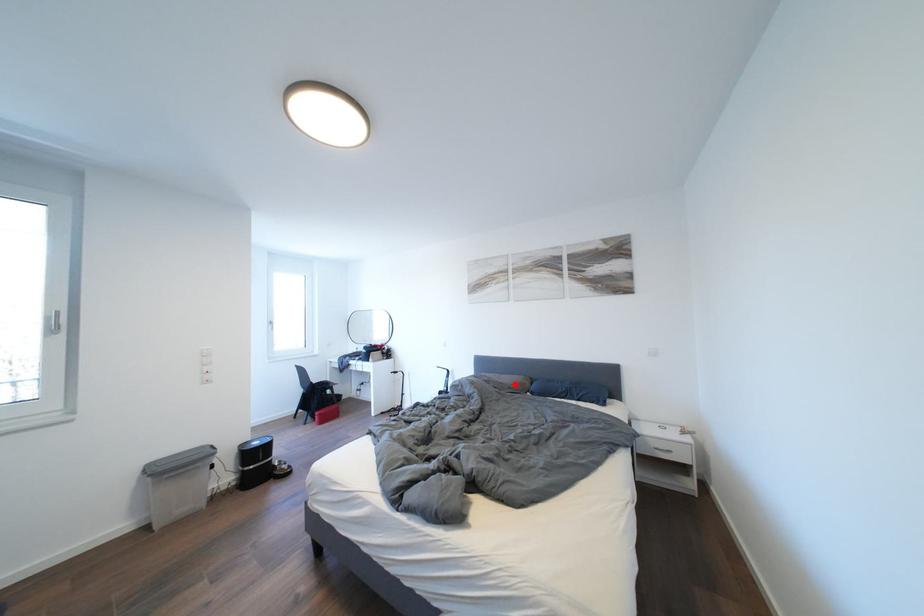
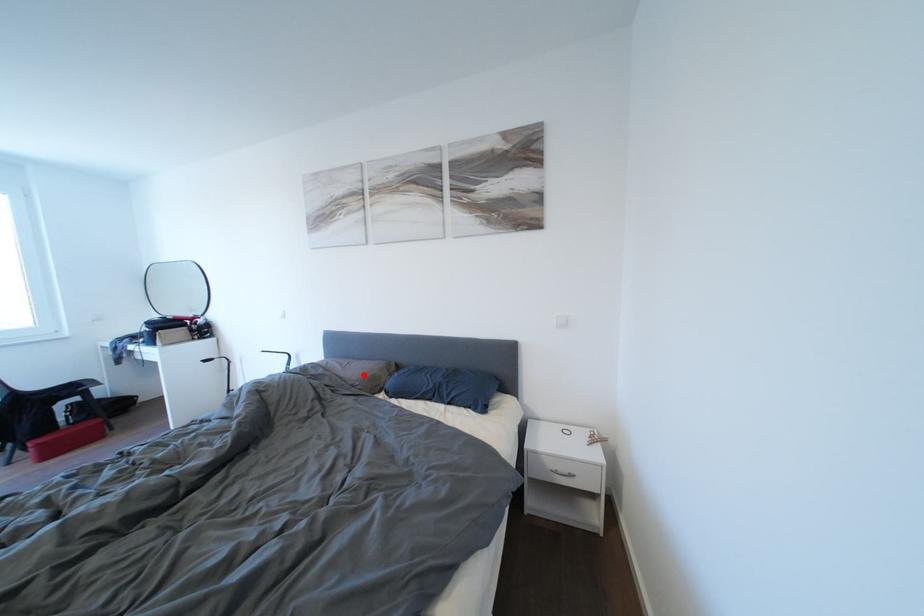
I am providing you with two images of the same scene from different viewpoints. A red point is marked on the first image and another point is marked on the second image. Does the point marked in image1 correspond to the same location as the one in image2?

Yes